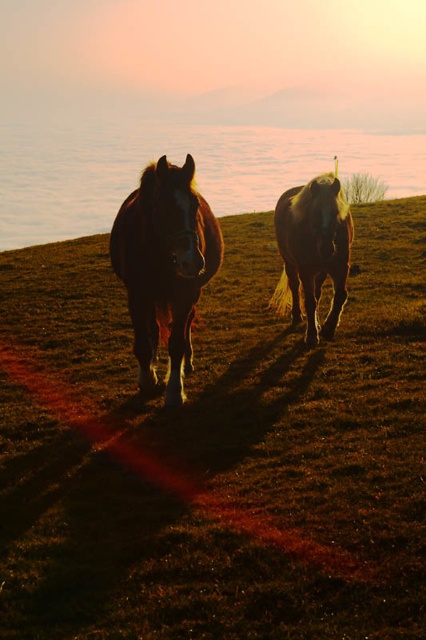
Question: In this image, where is brown grassy at center located relative to shiny brown horse at center?

Choices:
 (A) right
 (B) left

Answer: (B)

Question: Can you confirm if brown grassy at center is wider than shiny brown horse at center?

Choices:
 (A) yes
 (B) no

Answer: (A)

Question: Which point is farther from the camera taking this photo?

Choices:
 (A) (340, 204)
 (B) (134, 241)
 (C) (8, 408)

Answer: (A)

Question: Which point is farther to the camera?

Choices:
 (A) translucent glass water at center
 (B) shiny brown horse at center
 (C) brown grassy at center

Answer: (A)

Question: Which object is the closest to the shiny brown horse at center?

Choices:
 (A) shiny brown horse at right
 (B) brown grassy at center

Answer: (B)

Question: Does shiny brown horse at center appear on the right side of shiny brown horse at right?

Choices:
 (A) no
 (B) yes

Answer: (A)